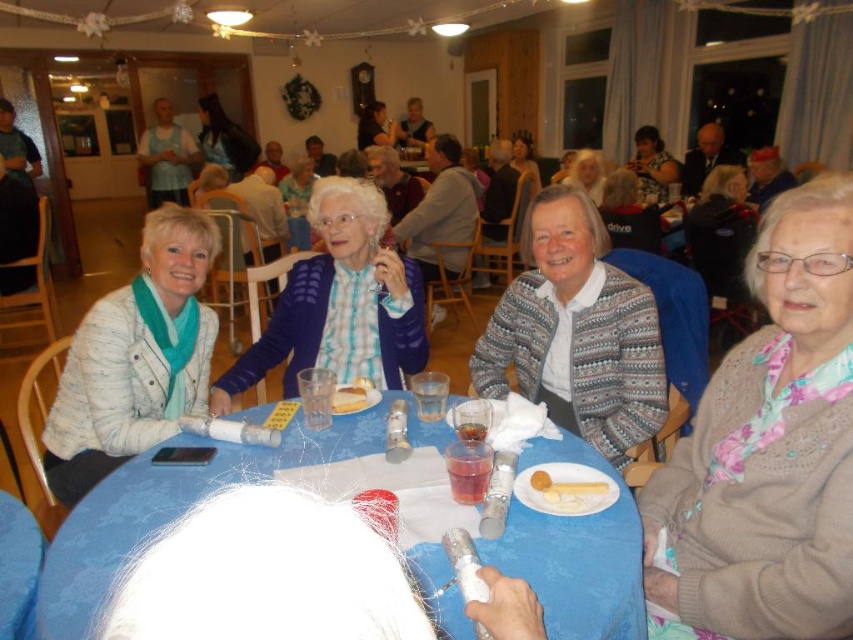
Question: Does brown knitted sweater at lower right appear on the right side of matte gray sweater at upper center?

Choices:
 (A) yes
 (B) no

Answer: (B)

Question: Considering the real-world distances, which object is farthest from the matte blue sweater at center?

Choices:
 (A) blue textured sweater at center
 (B) matte gray sweater at upper center

Answer: (A)

Question: Which object is the farthest from the white paper plate at center?

Choices:
 (A) blue fabric table at center
 (B) white textured sweater at left
 (C) yellow sponge cake at center
 (D) blue textured sweater at center

Answer: (C)

Question: Where is matte blue sweater at center located in relation to white paper plate at center in the image?

Choices:
 (A) left
 (B) right

Answer: (A)

Question: Which object is the closest to the white textured sweater at left?

Choices:
 (A) knitted sweater at center
 (B) brown knitted sweater at lower right

Answer: (B)

Question: Does white textured sweater at left have a larger size compared to matte gray sweater at center?

Choices:
 (A) no
 (B) yes

Answer: (B)